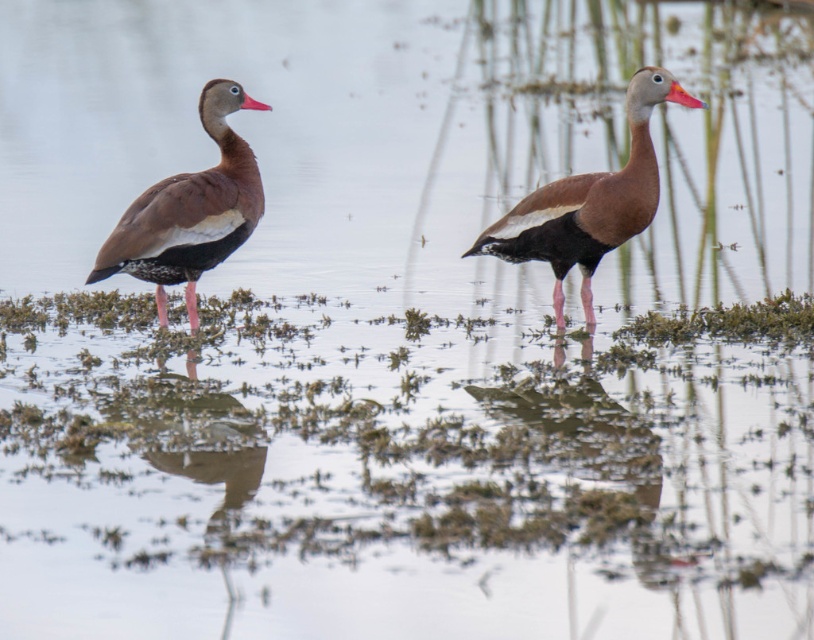
Is brown matte duck at left taller than brown matte duck at right?

In fact, brown matte duck at left may be shorter than brown matte duck at right.

Can you confirm if brown matte duck at left is positioned to the right of brown matte duck at right?

No, brown matte duck at left is not to the right of brown matte duck at right.

Is point (235, 225) farther from camera compared to point (571, 250)?

No, it is in front of (571, 250).

Where is `brown matte duck at left`? This screenshot has width=814, height=640. brown matte duck at left is located at coordinates (190, 211).